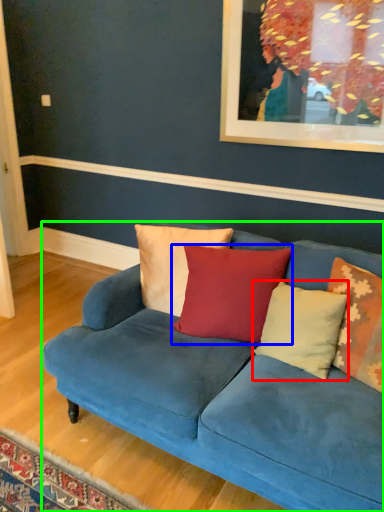
Question: Based on their relative distances, which object is farther from pillow (highlighted by a red box)? Choose from pillow (highlighted by a blue box) and studio couch (highlighted by a green box).

Choices:
 (A) pillow
 (B) studio couch

Answer: (B)